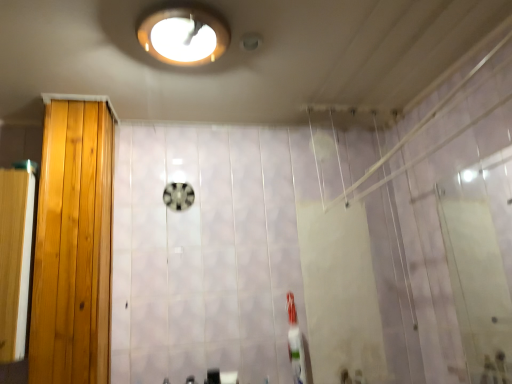
Question: Does wooden screen door at left, which ranks as the second screen door in right-to-left order, have a larger size compared to light brown wood door at left?

Choices:
 (A) no
 (B) yes

Answer: (A)

Question: Is light brown wood door at left at the back of wooden screen door at left, arranged as the first screen door when viewed from the left?

Choices:
 (A) yes
 (B) no

Answer: (B)

Question: Does wooden screen door at left, arranged as the first screen door when viewed from the left, touch light brown wood door at left?

Choices:
 (A) yes
 (B) no

Answer: (B)

Question: From the image's perspective, is wooden screen door at left, arranged as the first screen door when viewed from the left, on top of light brown wood door at left?

Choices:
 (A) yes
 (B) no

Answer: (B)

Question: From a real-world perspective, is wooden screen door at left, arranged as the first screen door when viewed from the left, on top of light brown wood door at left?

Choices:
 (A) no
 (B) yes

Answer: (A)

Question: From the image's perspective, relative to matte white light fixture at upper center, is transparent glass screen door at right, the second screen door viewed from the left, above or below?

Choices:
 (A) below
 (B) above

Answer: (A)

Question: In terms of height, does transparent glass screen door at right, the second screen door viewed from the left, look taller or shorter compared to matte white light fixture at upper center?

Choices:
 (A) tall
 (B) short

Answer: (A)

Question: Considering the positions of transparent glass screen door at right, the 1th screen door from the right, and matte white light fixture at upper center in the image, is transparent glass screen door at right, the 1th screen door from the right, wider or thinner than matte white light fixture at upper center?

Choices:
 (A) thin
 (B) wide

Answer: (A)

Question: Considering the relative positions of transparent glass screen door at right, the 1th screen door from the right, and matte white light fixture at upper center in the image provided, is transparent glass screen door at right, the 1th screen door from the right, to the left or to the right of matte white light fixture at upper center?

Choices:
 (A) right
 (B) left

Answer: (A)

Question: Considering the positions of point (89, 162) and point (224, 26), is point (89, 162) closer or farther from the camera than point (224, 26)?

Choices:
 (A) closer
 (B) farther

Answer: (B)

Question: Considering the relative positions of light brown wood door at left and matte white light fixture at upper center in the image provided, is light brown wood door at left to the left or to the right of matte white light fixture at upper center?

Choices:
 (A) right
 (B) left

Answer: (B)

Question: Considering their positions, is light brown wood door at left located in front of or behind matte white light fixture at upper center?

Choices:
 (A) behind
 (B) front

Answer: (A)

Question: Based on their sizes in the image, would you say light brown wood door at left is bigger or smaller than matte white light fixture at upper center?

Choices:
 (A) big
 (B) small

Answer: (A)

Question: Is wooden screen door at left, arranged as the first screen door when viewed from the left, taller or shorter than light brown wood door at left?

Choices:
 (A) short
 (B) tall

Answer: (A)

Question: Is wooden screen door at left, arranged as the first screen door when viewed from the left, wider or thinner than light brown wood door at left?

Choices:
 (A) thin
 (B) wide

Answer: (B)